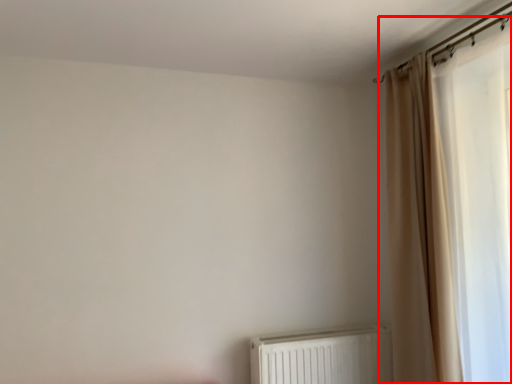
Question: From the image's perspective, where is curtain (annotated by the red box) located relative to radiator?

Choices:
 (A) below
 (B) above

Answer: (B)